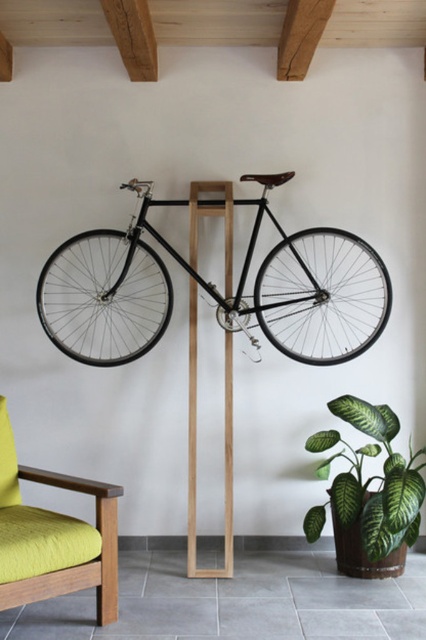
Is shiny black bicycle at center positioned in front of lime green fabric couch at lower left?

No, shiny black bicycle at center is further to the viewer.

Can you confirm if shiny black bicycle at center is positioned below lime green fabric couch at lower left?

No.

Locate an element on the screen. This screenshot has width=426, height=640. shiny black bicycle at center is located at coordinates (213, 289).

Image resolution: width=426 pixels, height=640 pixels. I want to click on shiny black bicycle at center, so click(213, 289).

Is lime green fabric couch at lower left below green matte leafy plant at lower right?

Actually, lime green fabric couch at lower left is above green matte leafy plant at lower right.

Does lime green fabric couch at lower left have a lesser width compared to green matte leafy plant at lower right?

Incorrect, lime green fabric couch at lower left's width is not less than green matte leafy plant at lower right's.

Does point (8, 515) come farther from viewer compared to point (374, 492)?

No, (8, 515) is closer to viewer.

The width and height of the screenshot is (426, 640). What are the coordinates of `lime green fabric couch at lower left` in the screenshot? It's located at (54, 538).

Consider the image. Who is more distant from viewer, (388, 481) or (215, 204)?

Point (215, 204)

Does green matte leafy plant at lower right have a greater height compared to wooden beam at center?

Incorrect, green matte leafy plant at lower right's height is not larger of wooden beam at center's.

Is point (397, 465) more distant than point (193, 513)?

No, (397, 465) is closer to viewer.

Identify the location of green matte leafy plant at lower right. This screenshot has height=640, width=426. tap(373, 480).